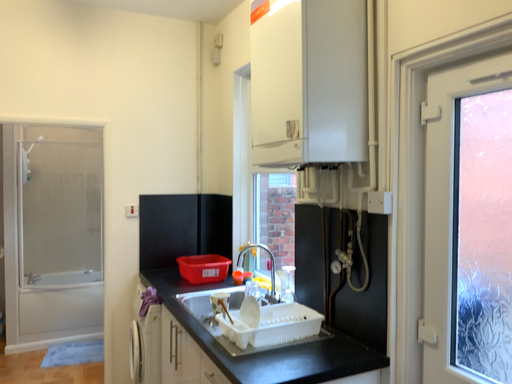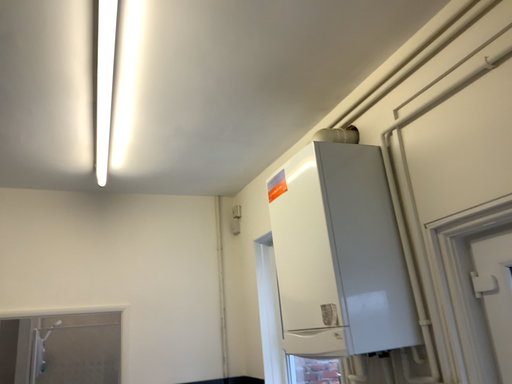
Question: How did the camera likely rotate when shooting the video?

Choices:
 (A) rotated upward
 (B) rotated downward

Answer: (A)